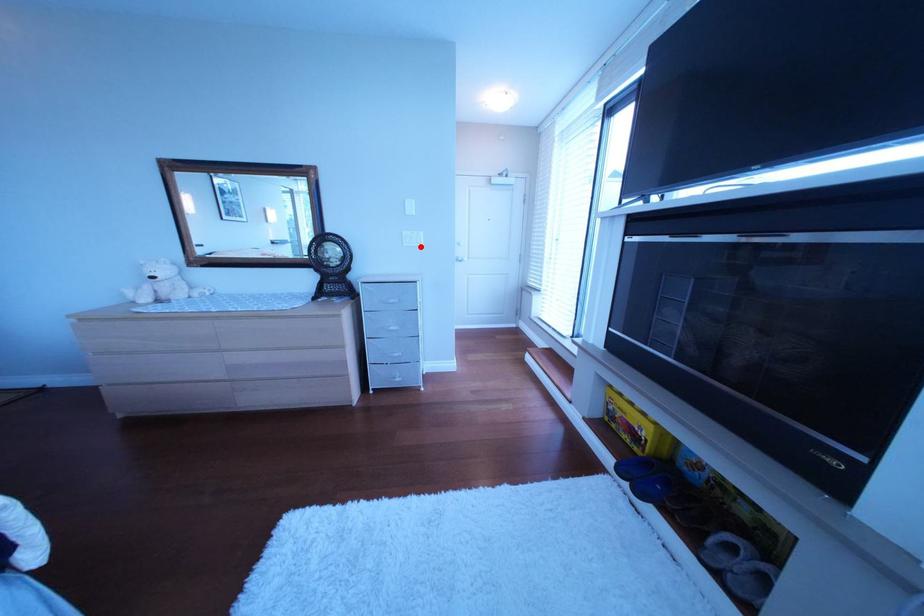
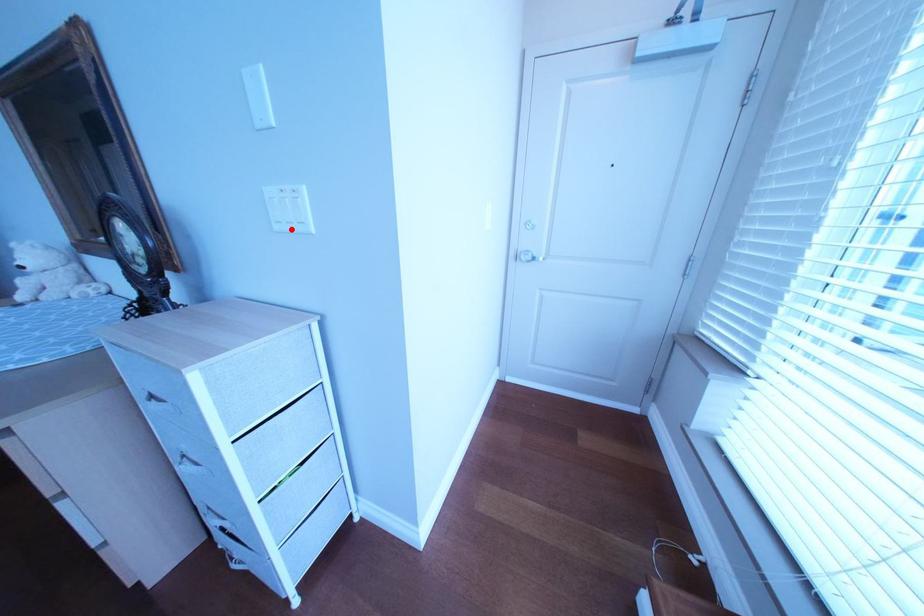
I am providing you with two images of the same scene from different viewpoints. A red point is marked on the first image and another point is marked on the second image. Are the points marked in image1 and image2 representing the same 3D position?

Yes